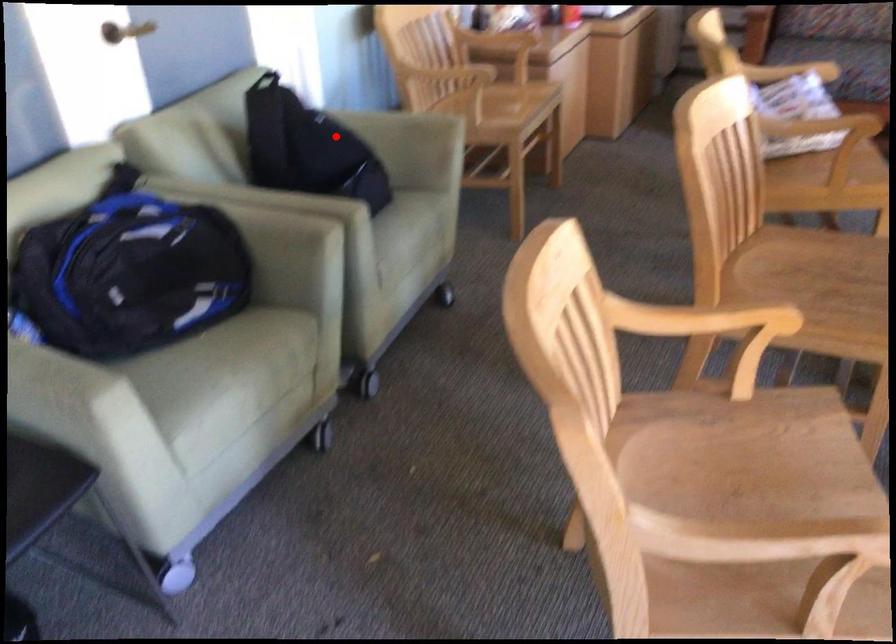
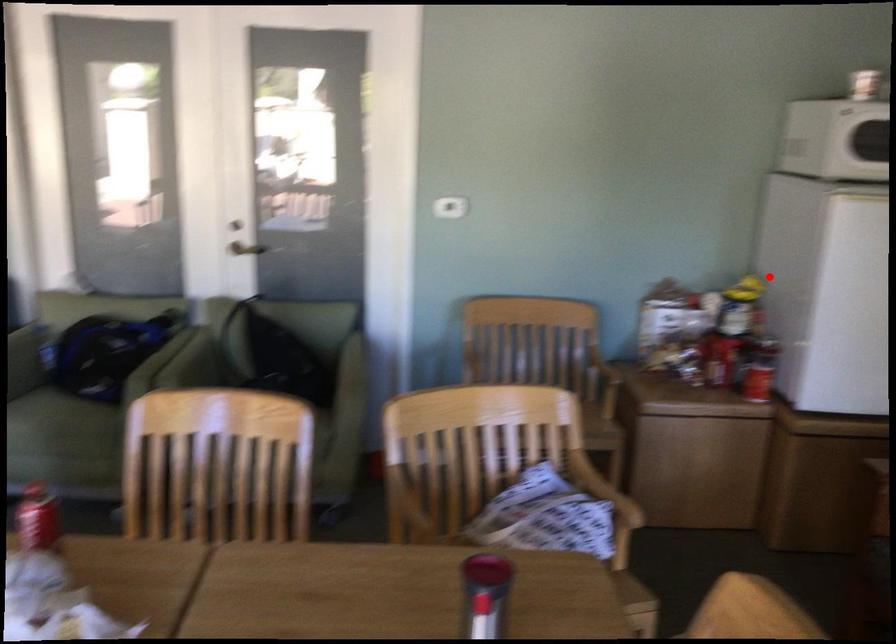
I am providing you with two images of the same scene from different viewpoints. A red point is marked on the first image and another point is marked on the second image. Do the highlighted points in image1 and image2 indicate the same real-world spot?

No